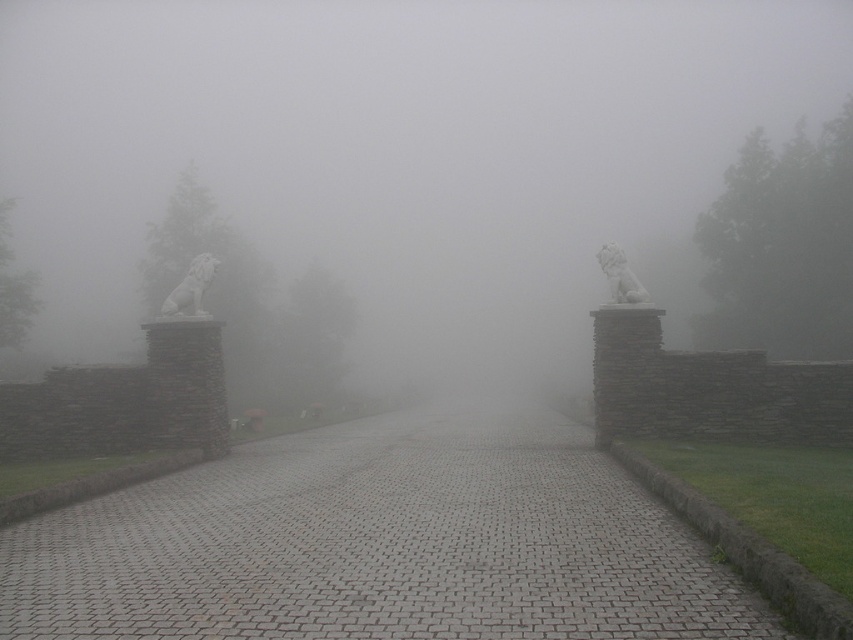
Question: Considering the real-world distances, which object is closest to the white marble lion at right?

Choices:
 (A) white stone lion at left
 (B) white stone lions at center

Answer: (A)

Question: Which of the following is the closest to the observer?

Choices:
 (A) white marble lion at right
 (B) white stone lion at left

Answer: (A)

Question: Which point is farther from the camera taking this photo?

Choices:
 (A) (624, 262)
 (B) (164, 301)
 (C) (366, 380)

Answer: (C)

Question: Does gray cobblestone path at center appear under white stone lion at left?

Choices:
 (A) yes
 (B) no

Answer: (A)

Question: Is gray cobblestone path at center below white stone lion at left?

Choices:
 (A) yes
 (B) no

Answer: (A)

Question: Is white stone lion at left behind white marble lion at right?

Choices:
 (A) no
 (B) yes

Answer: (B)